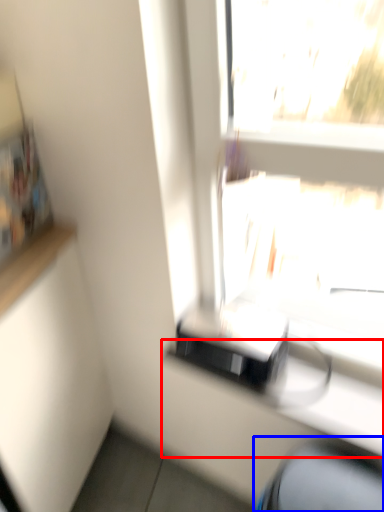
Question: Which point is further to the camera, counter (highlighted by a red box) or computer chair (highlighted by a blue box)?

Choices:
 (A) counter
 (B) computer chair

Answer: (A)